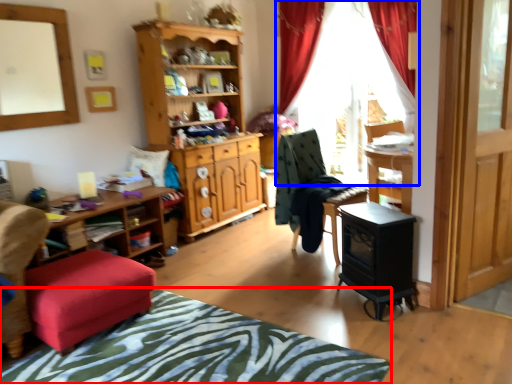
Question: Which point is closer to the camera, bedcover (highlighted by a red box) or curtain (highlighted by a blue box)?

Choices:
 (A) bedcover
 (B) curtain

Answer: (A)